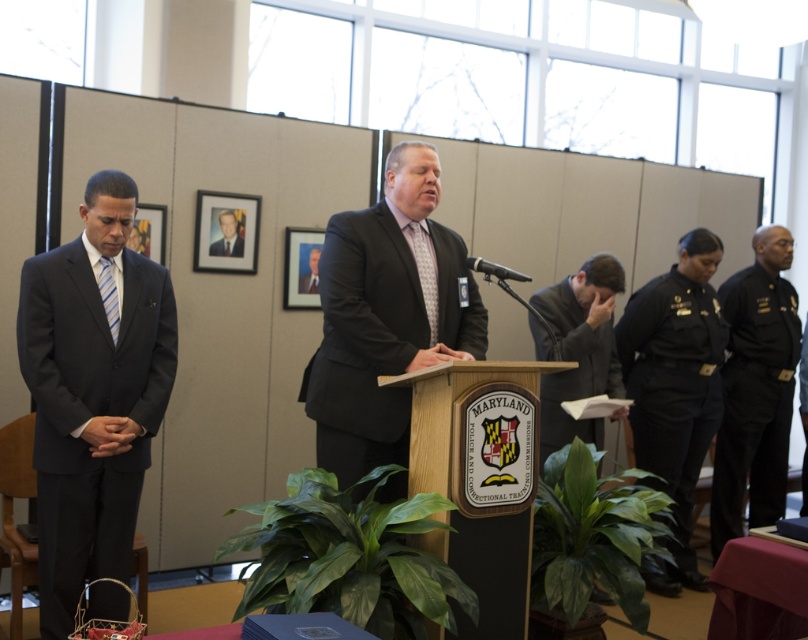
Looking at this image, you are organizing a photo shoot and need to ensure that all clothing items are appropriately sized for the models. Given the black uniform pants at right and the dark gray suit at center, which clothing item is bigger in size?

The black uniform pants at right has a larger size compared to the dark gray suit at center, so the black uniform pants at right is bigger in size.

You are an attendee at this event and you need to describe the speaker. Which object is positioned to the right of the other between the gray suit jacket at center and the dark gray suit at center?

The gray suit jacket at center is positioned to the right of the dark gray suit at center.

You are an attendee at the event and need to identify the speaker based on their clothing. Which object is positioned lower on the speaker, the gray suit jacket at center or the dark gray suit at center?

The gray suit jacket at center is located below the dark gray suit at center, so the gray suit jacket at center is positioned lower on the speaker.